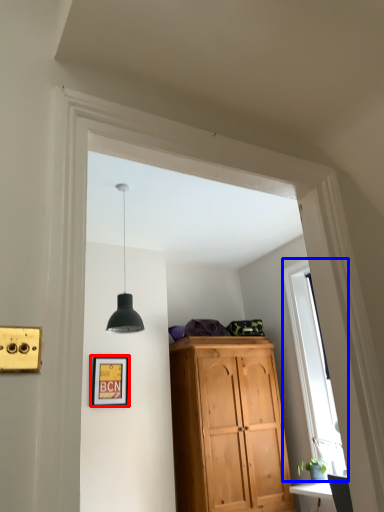
Question: Which object appears closest to the camera in this image, picture frame (highlighted by a red box) or window (highlighted by a blue box)?

Choices:
 (A) picture frame
 (B) window

Answer: (B)